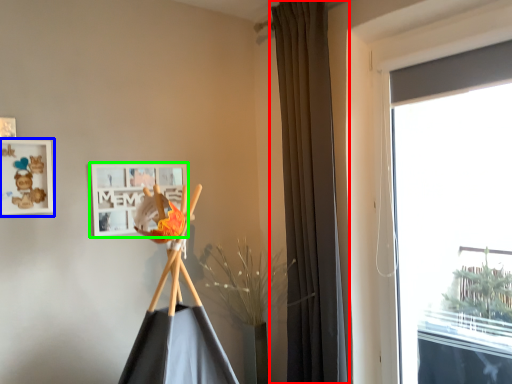
Question: Based on their relative distances, which object is farther from curtain (highlighted by a red box)? Choose from picture frame (highlighted by a blue box) and picture frame (highlighted by a green box).

Choices:
 (A) picture frame
 (B) picture frame

Answer: (A)